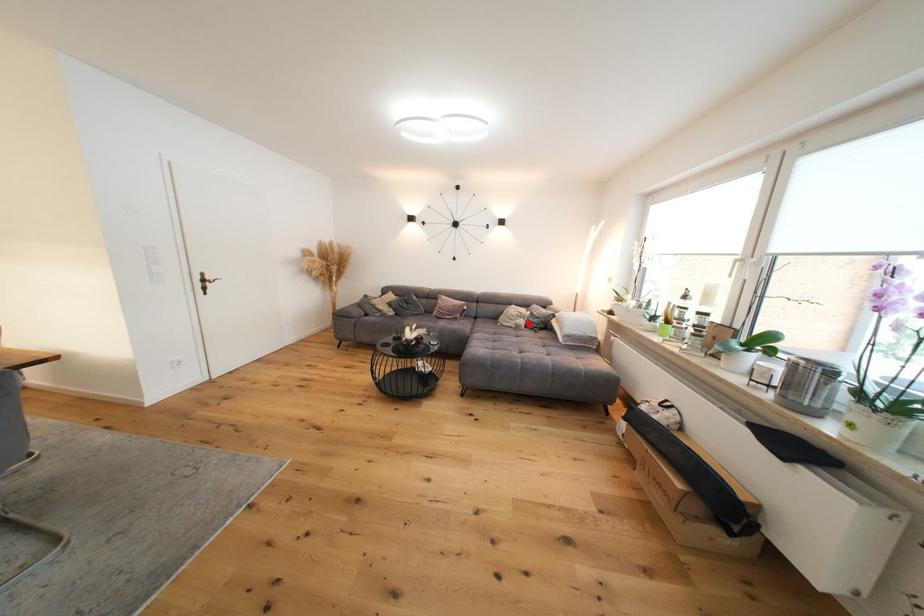
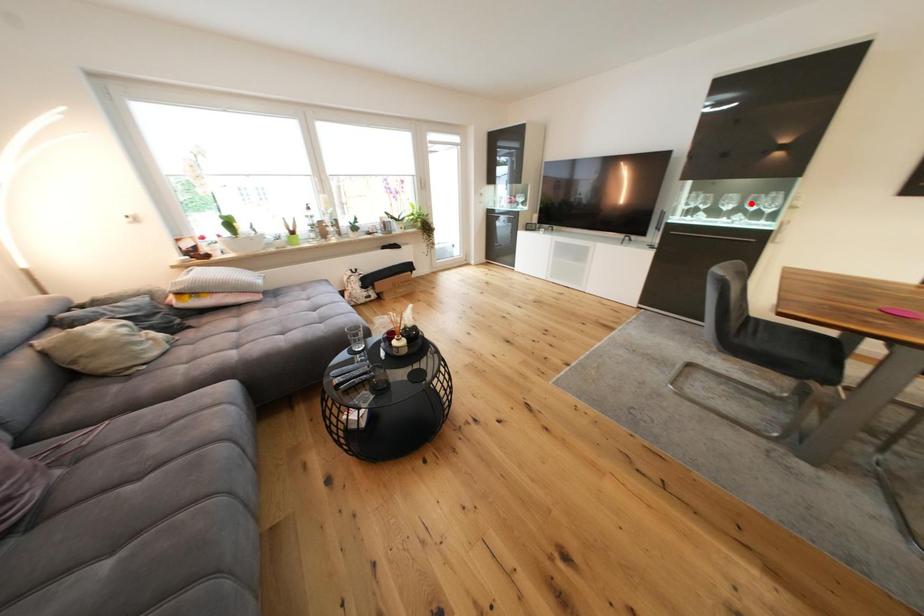
I am providing you with two images of the same scene from different viewpoints. A red point is marked on the first image and another point is marked on the second image. Is the red point in image1 aligned with the point shown in image2?

No